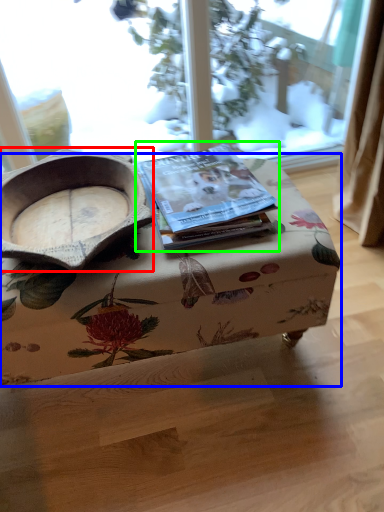
Question: Which is farther away from bowl (highlighted by a red box)? table (highlighted by a blue box) or paperback book (highlighted by a green box)?

Choices:
 (A) table
 (B) paperback book

Answer: (A)